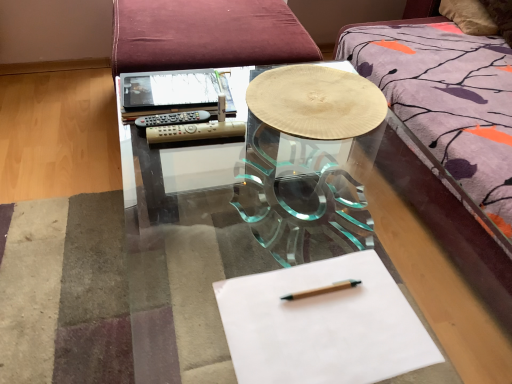
Find the location of a particular element. Image resolution: width=512 pixels, height=384 pixels. vacant area situated below matte black notebook at upper left (from a real-world perspective) is located at coordinates (174, 92).